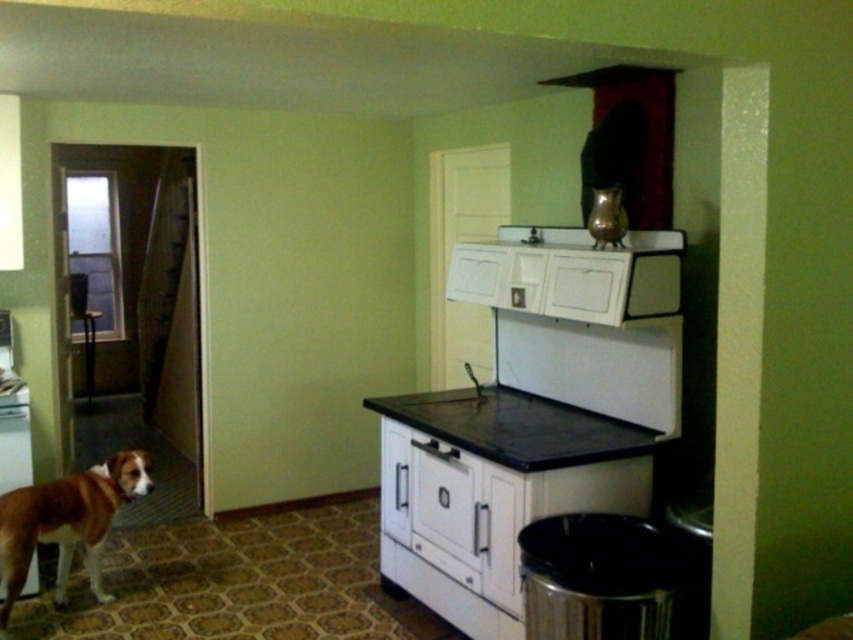
Who is shorter, black matte countertop at center or brown fur dog at lower left?

Standing shorter between the two is black matte countertop at center.

Can you confirm if black matte countertop at center is thinner than brown fur dog at lower left?

No, black matte countertop at center is not thinner than brown fur dog at lower left.

Looking at this image, measure the distance between black matte countertop at center and camera.

black matte countertop at center is 2.64 meters from camera.

You are a GUI agent. You are given a task and a screenshot of the screen. Output one action in this format:
    pyautogui.click(x=<x>, y=<y>)
    Task: Click on the black matte countertop at center
    This screenshot has width=853, height=640.
    Given the screenshot: What is the action you would take?
    pyautogui.click(x=518, y=428)

Can you confirm if brown fur dog at lower left is bigger than white matte refrigerator at left?

Yes.

Is brown fur dog at lower left shorter than white matte refrigerator at left?

No, brown fur dog at lower left is not shorter than white matte refrigerator at left.

The height and width of the screenshot is (640, 853). Find the location of `brown fur dog at lower left`. brown fur dog at lower left is located at coordinates (67, 522).

Between brown fur dog at lower left and metallic red exhaust hood at upper center, which one is positioned higher?

metallic red exhaust hood at upper center is above.

Does brown fur dog at lower left appear over metallic red exhaust hood at upper center?

No, brown fur dog at lower left is not above metallic red exhaust hood at upper center.

Which is in front, point (10, 518) or point (624, 76)?

Positioned in front is point (10, 518).

This screenshot has height=640, width=853. I want to click on brown fur dog at lower left, so click(67, 522).